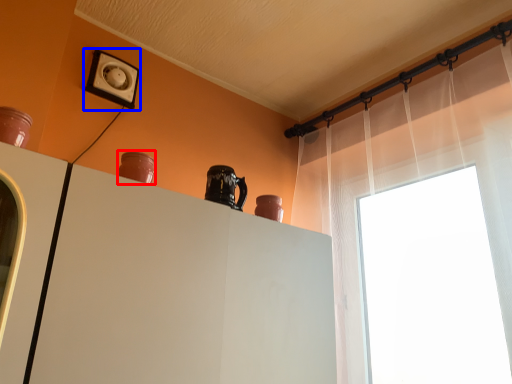
Question: Which point is closer to the camera, vase (highlighted by a red box) or electric outlet (highlighted by a blue box)?

Choices:
 (A) vase
 (B) electric outlet

Answer: (A)